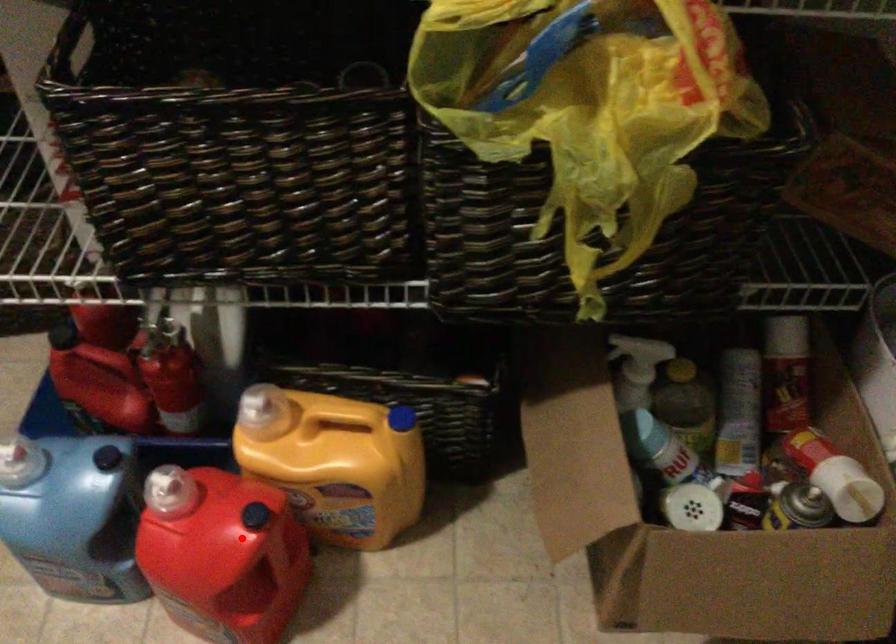
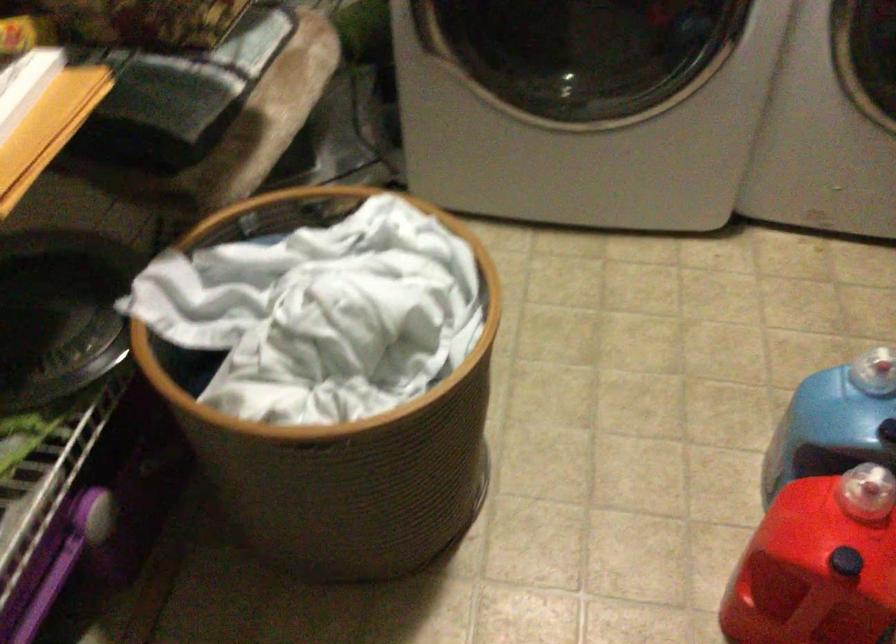
Question: I am providing you with two images of the same scene from different viewpoints. A red point is marked on the first image. At the location where the point appears in image 1, is it still visible in image 2?

Choices:
 (A) Yes
 (B) No

Answer: (A)